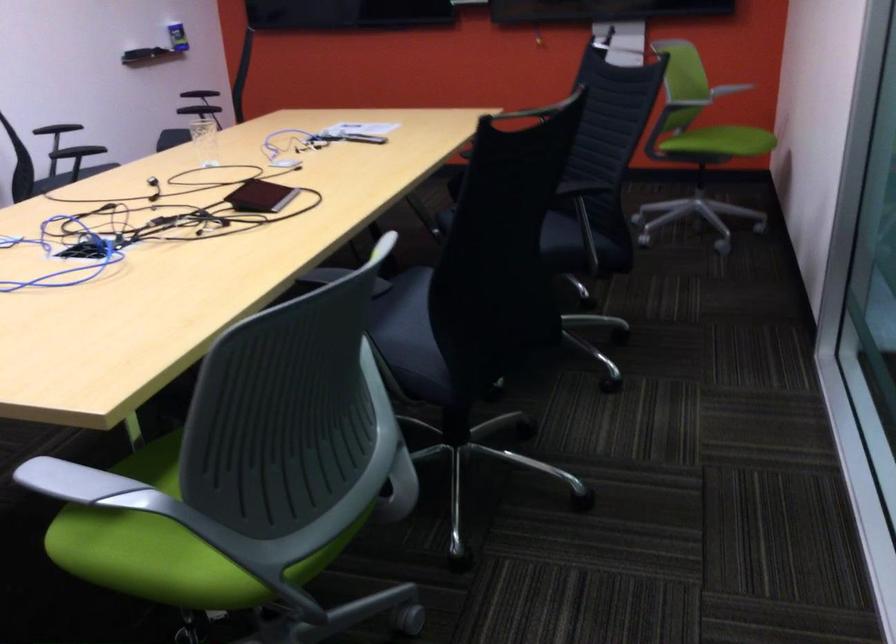
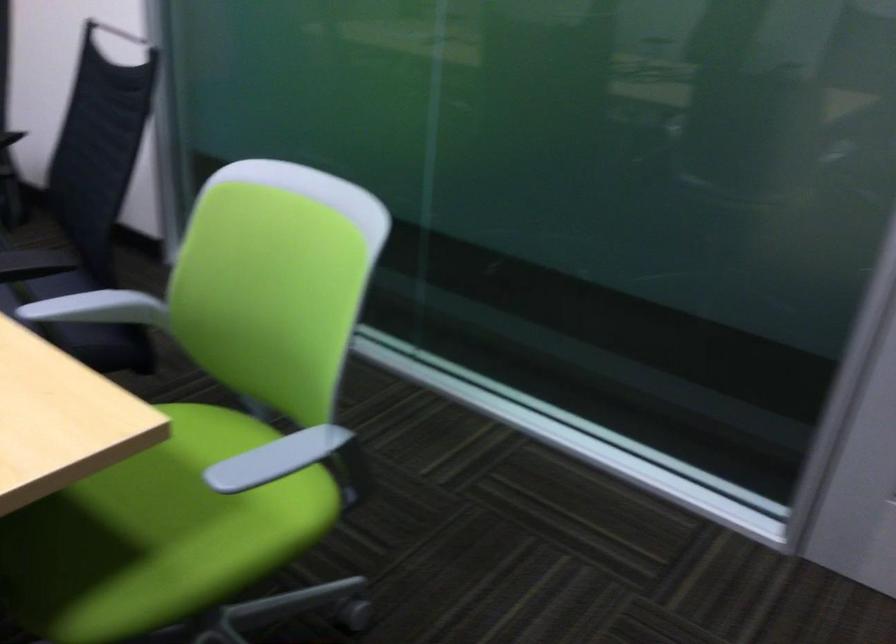
The point at [142,529] is marked in the first image. Where is the corresponding point in the second image?

(157, 534)